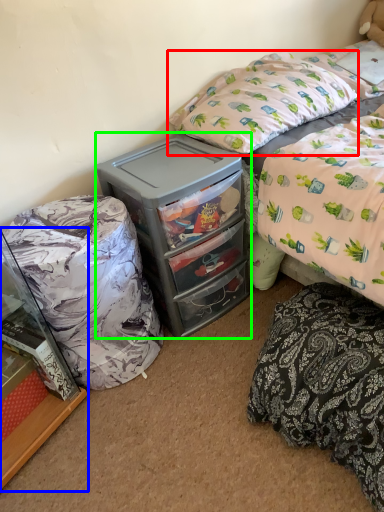
Question: Which object is positioned closest to pillow (highlighted by a red box)? Select from cabinetry (highlighted by a blue box) and chest of drawers (highlighted by a green box).

Choices:
 (A) cabinetry
 (B) chest of drawers

Answer: (B)